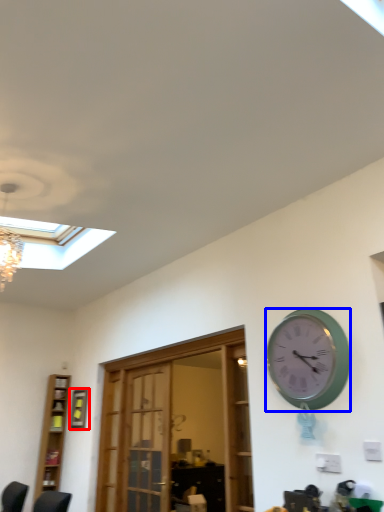
Question: Which of the following is the closest to the observer, picture frame (highlighted by a red box) or wall clock (highlighted by a blue box)?

Choices:
 (A) picture frame
 (B) wall clock

Answer: (B)